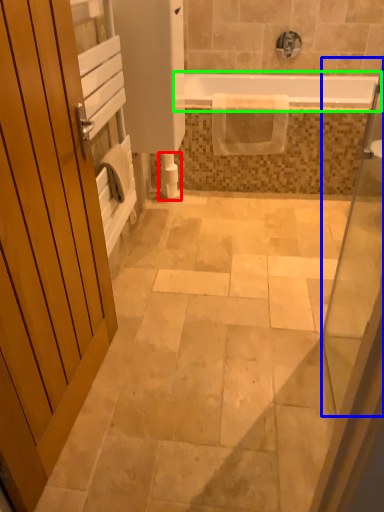
Question: Based on their relative distances, which object is farther from toilet paper (highlighted by a red box)? Choose from glass door (highlighted by a blue box) and bathtub (highlighted by a green box).

Choices:
 (A) glass door
 (B) bathtub

Answer: (A)